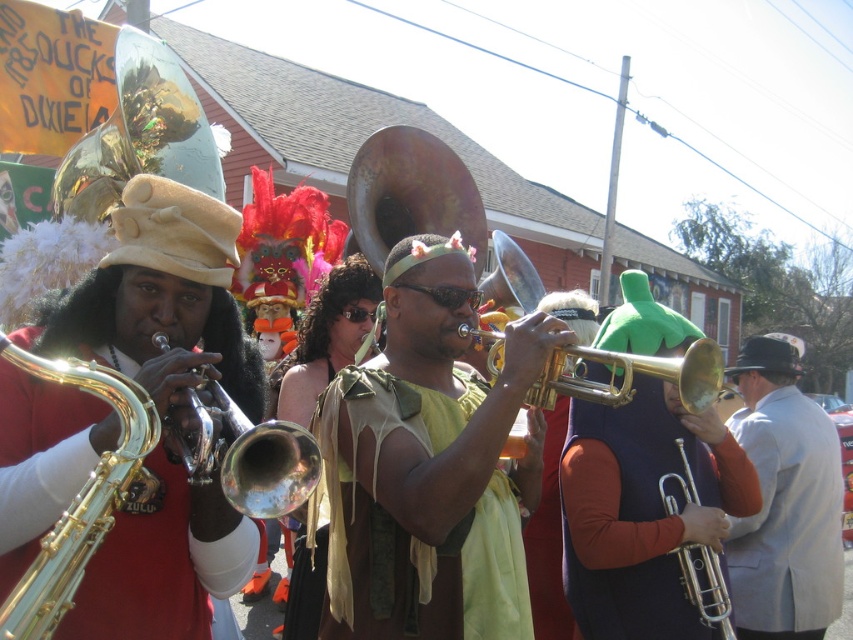
You are a photographer trying to capture a photo of the gold fabric with fringe at center and the gray wool suit at right. Based on their heights, which object should you focus on first to ensure it doesn t get cropped out?

The gold fabric with fringe at center is taller than the gray wool suit at right, so you should focus on the gold fabric with fringe at center first to ensure it doesn t get cropped out due to its greater height.

Looking at this image, you are organizing a photo shoot and need to place two props in the scene. The first prop is a large golden statue that should match the gold fabric with fringe at center, and the second is a sleek black podium for the gray wool suit at right. Given their sizes, which prop should be placed closer to the camera to maintain visual balance?

The gold fabric with fringe at center is wider than the gray wool suit at right, so the sleek black podium for the gray wool suit at right should be placed closer to the camera to balance their sizes.